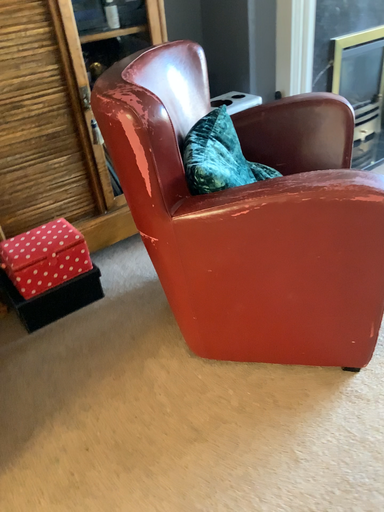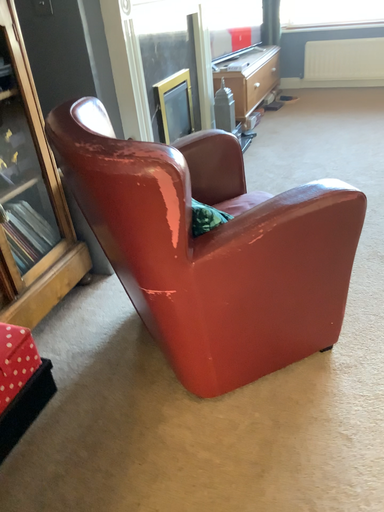
Question: How did the camera likely rotate when shooting the video?

Choices:
 (A) rotated right
 (B) rotated left

Answer: (A)